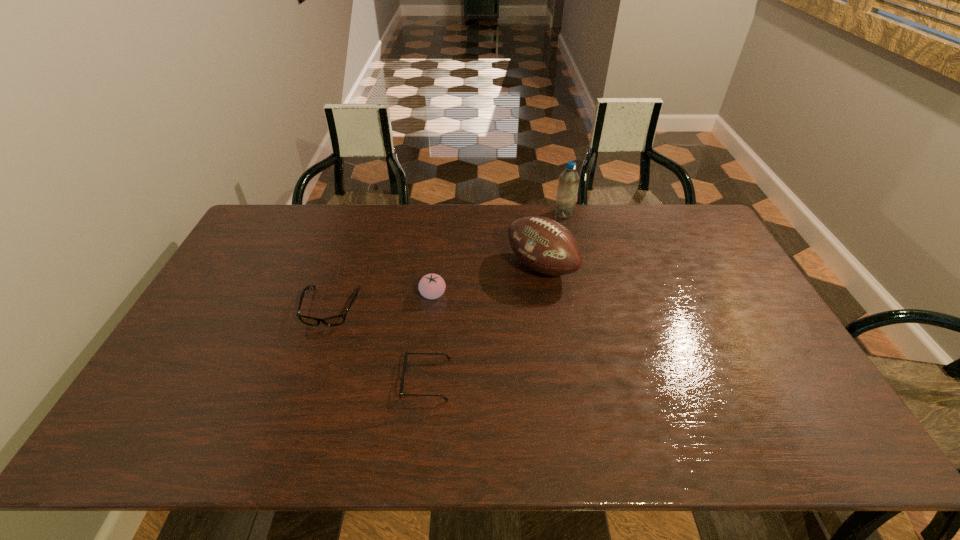
Locate an element on the screen. The height and width of the screenshot is (540, 960). vacant area between the nearest object and the tomato is located at coordinates [430, 337].

The width and height of the screenshot is (960, 540). Identify the location of free area in between the farther spectacles and the water bottle. (447, 260).

Locate an element on the screen. Image resolution: width=960 pixels, height=540 pixels. vacant space that's between the nearer spectacles and the third shortest object is located at coordinates (430, 337).

The image size is (960, 540). Identify the location of free area in between the farthest object and the third shortest object. pos(498,254).

This screenshot has height=540, width=960. In order to click on free space between the nearer spectacles and the farther spectacles in this screenshot , I will do `click(379, 343)`.

This screenshot has width=960, height=540. What are the coordinates of `empty space that is in between the water bottle and the third shortest object` in the screenshot? It's located at (498, 254).

Find the location of a particular element. unoccupied area between the shortest object and the third shortest object is located at coordinates (430, 337).

Find the location of a particular element. The width and height of the screenshot is (960, 540). blank region between the right spectacles and the taller spectacles is located at coordinates (379, 343).

Locate an element on the screen. This screenshot has width=960, height=540. empty location between the shortest object and the water bottle is located at coordinates (495, 296).

The image size is (960, 540). What are the coordinates of `empty space between the taller spectacles and the nearest object` in the screenshot? It's located at (379, 343).